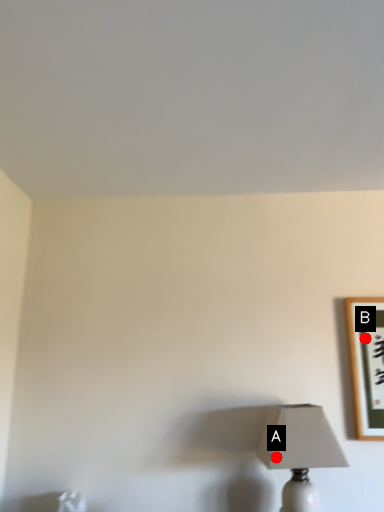
Question: Two points are circled on the image, labeled by A and B beside each circle. Which point is closer to the camera?

Choices:
 (A) A is closer
 (B) B is closer

Answer: (A)